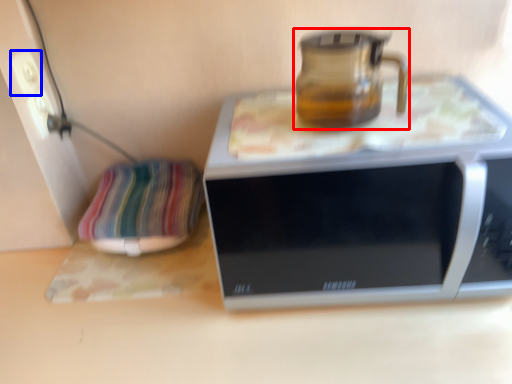
Question: Among these objects, which one is farthest to the camera, jug (highlighted by a red box) or electric outlet (highlighted by a blue box)?

Choices:
 (A) jug
 (B) electric outlet

Answer: (B)